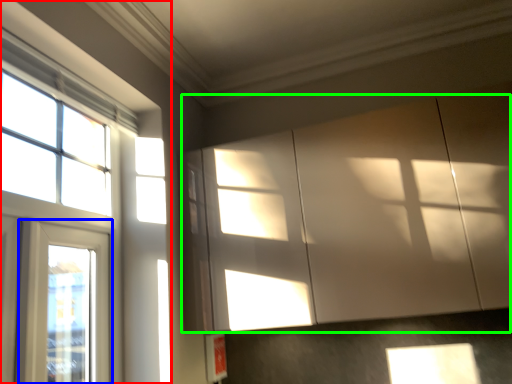
Question: Considering the real-world distances, which object is closest to window (highlighted by a red box)? window (highlighted by a blue box) or cabinetry (highlighted by a green box).

Choices:
 (A) window
 (B) cabinetry

Answer: (A)